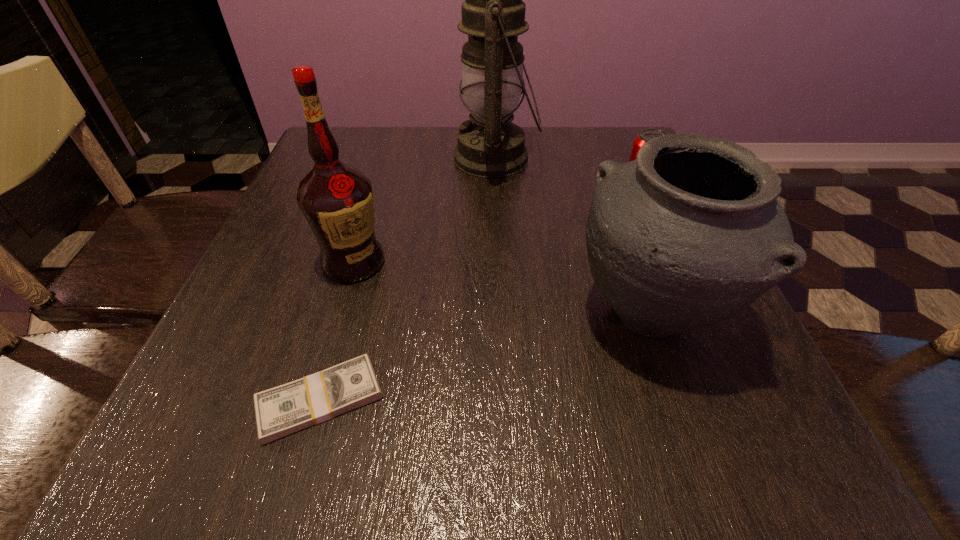
This screenshot has height=540, width=960. In order to click on vacant area situated on the right of the shortest object in this screenshot , I will do `click(640, 400)`.

Where is `object situated at the far edge`? object situated at the far edge is located at coordinates (493, 14).

At what (x,y) coordinates should I click in order to perform the action: click on object that is at the near edge. Please return your answer as a coordinate pair (x, y). The height and width of the screenshot is (540, 960). Looking at the image, I should click on (280, 411).

The image size is (960, 540). Identify the location of alcohol located in the left edge section of the desktop. (336, 199).

What are the coordinates of `dollar at the left edge` in the screenshot? It's located at (280, 411).

You are a GUI agent. You are given a task and a screenshot of the screen. Output one action in this format:
    pyautogui.click(x=<x>, y=<y>)
    Task: Click on the urn at the right edge
    Image resolution: width=960 pixels, height=540 pixels.
    Given the screenshot: What is the action you would take?
    pyautogui.click(x=691, y=233)

In order to click on can located in the right edge section of the desktop in this screenshot , I will do `click(645, 135)`.

The image size is (960, 540). Identify the location of object that is at the near left corner. (280, 411).

At what (x,y) coordinates should I click in order to perform the action: click on free location at the far edge. Please return your answer as a coordinate pair (x, y). Image resolution: width=960 pixels, height=540 pixels. Looking at the image, I should click on (446, 150).

I want to click on blank area at the left edge, so click(x=300, y=177).